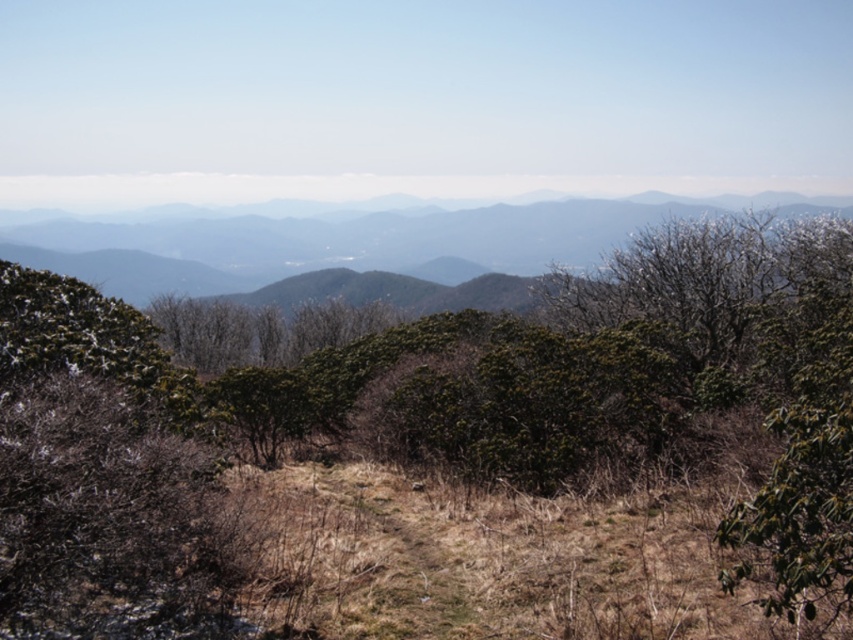
Question: Does green leafy bush at center appear on the left side of grayish-brown rocky mountain at center?

Choices:
 (A) no
 (B) yes

Answer: (A)

Question: Can you confirm if green leafy bush at center is positioned above grayish-brown rocky mountain at center?

Choices:
 (A) no
 (B) yes

Answer: (A)

Question: Is green leafy bush at center further to camera compared to grayish-brown rocky mountain at center?

Choices:
 (A) yes
 (B) no

Answer: (B)

Question: Which point is farther to the camera?

Choices:
 (A) [515, 237]
 (B) [352, 628]

Answer: (A)